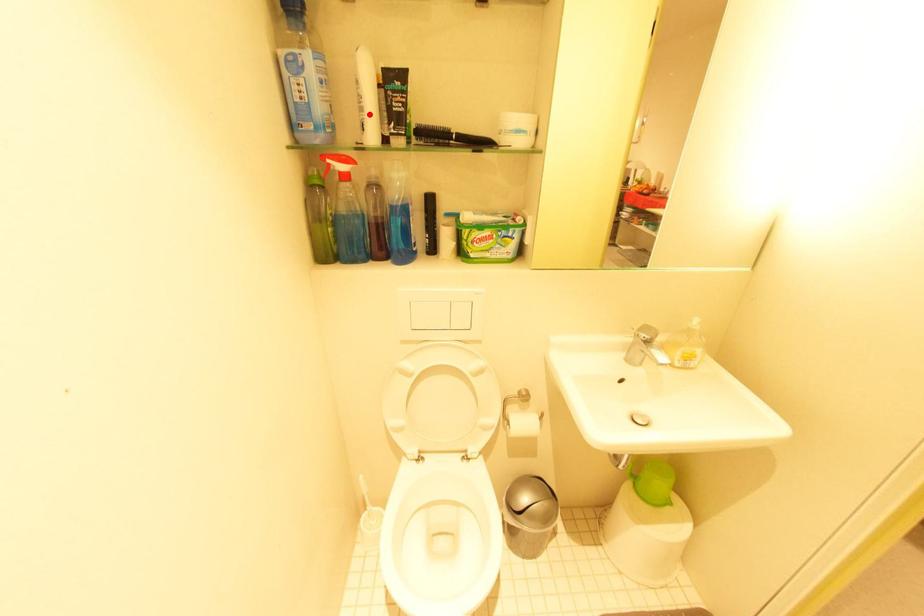
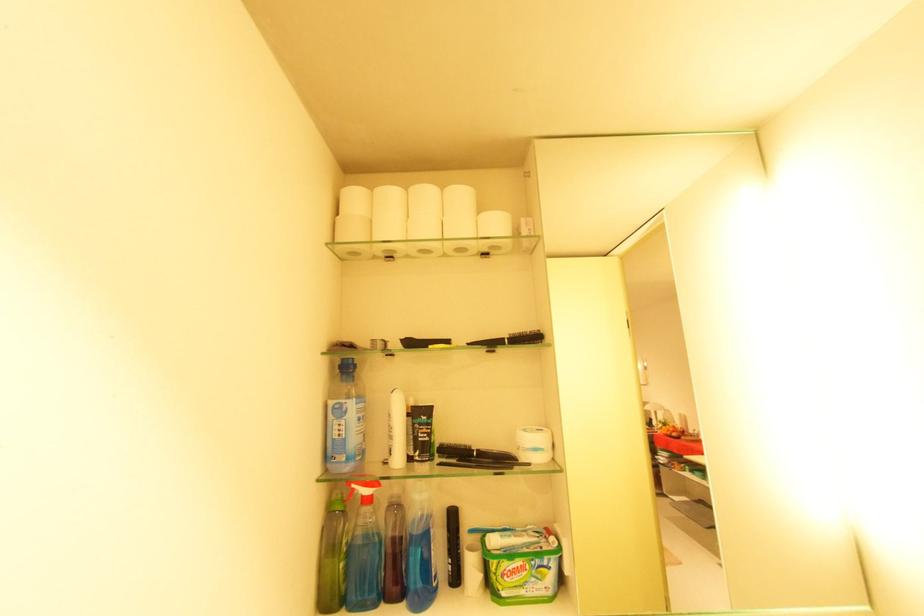
In the second image, find the point that corresponds to the highlighted location in the first image.

(398, 442)